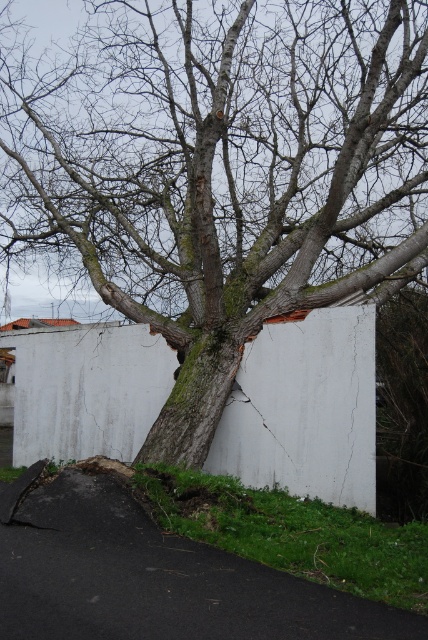
Is green rough bark tree at center to the right of white concrete wall at center from the viewer's perspective?

Correct, you'll find green rough bark tree at center to the right of white concrete wall at center.

Between green rough bark tree at center and white concrete wall at center, which one is positioned higher?

green rough bark tree at center

Who is more forward, (412, 36) or (50, 426)?

Point (412, 36) is more forward.

Image resolution: width=428 pixels, height=640 pixels. In order to click on green rough bark tree at center in this screenshot , I will do `click(222, 172)`.